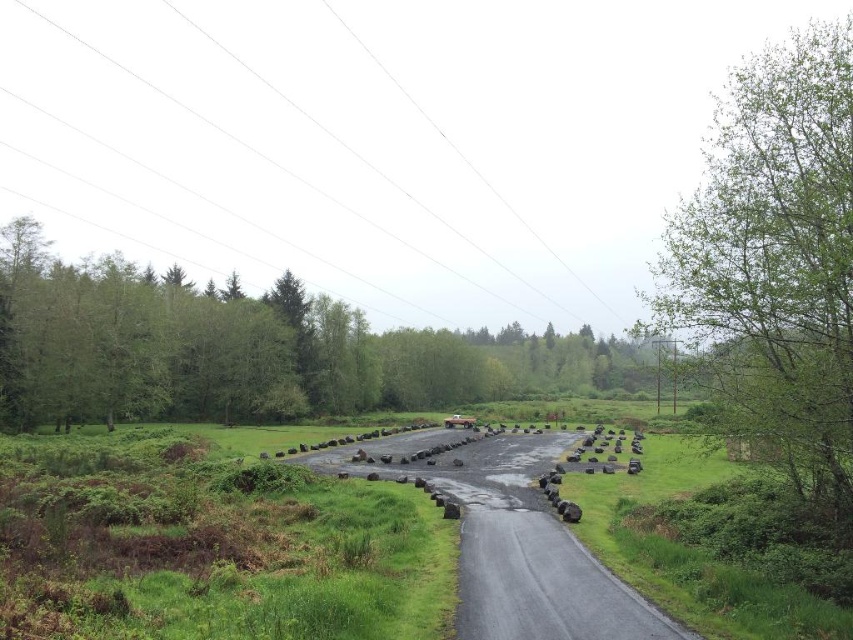
You are a drone operator planning to fly a drone from point A to point B in the rural scene described. Point A is at point [1,269] and point B is at point [824,54]. According to the scene description, which point is closer to the forested background?

Point [1,269] is behind point [824,54], so point [1,269] is closer to the forested background.

You are standing at the point labeled as point (244, 349) in the image. Looking around, what do you see immediately to your left and right?

To your left, you see the dense vegetation and shrubs along the left side of the road, and to your right, you see the neatly arranged row of large dark rocks on the right side of the road. The point (244, 349) corresponds to a green leafy tree at left, so your immediate surroundings include the natural vegetation on the left and the landscaped rocks on the right.